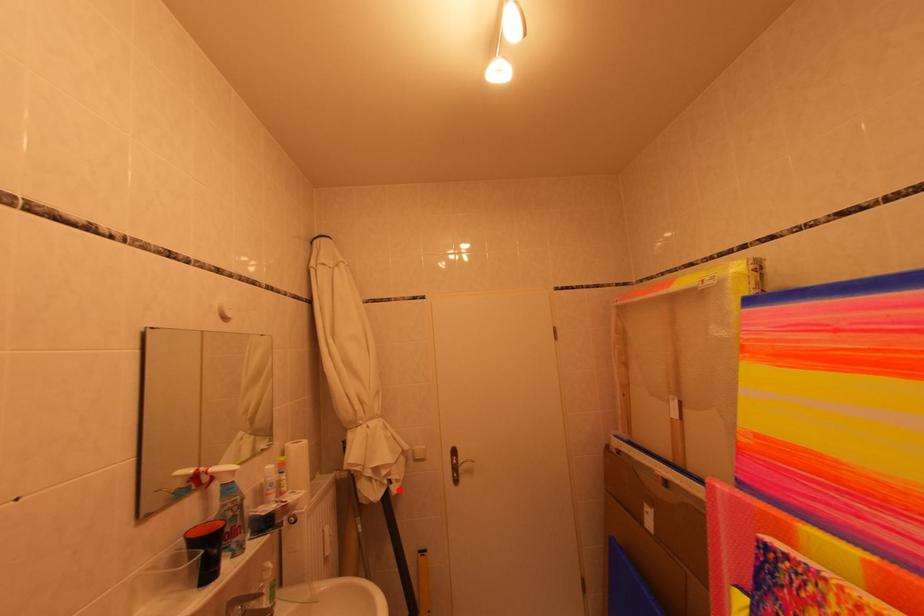
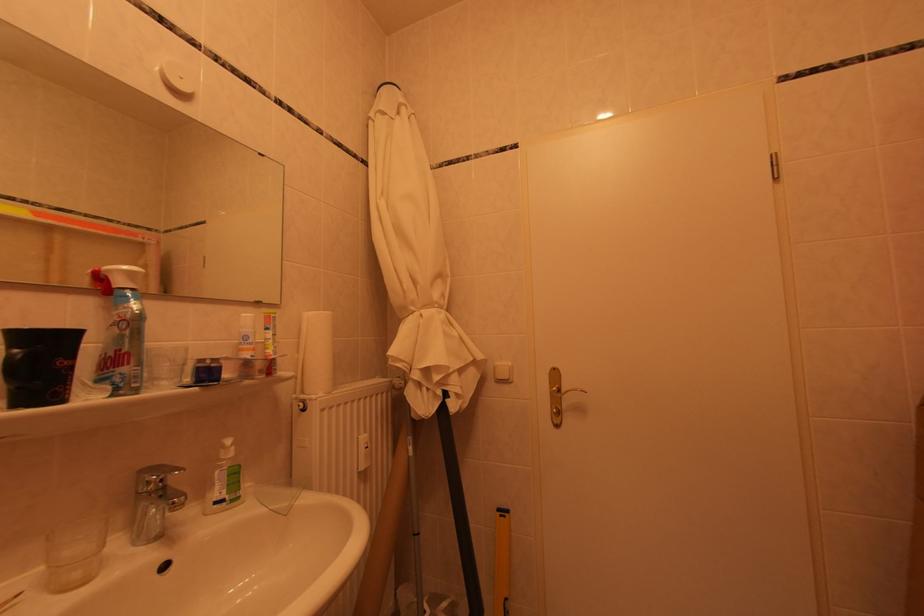
In the second image, find the point that corresponds to the highlighted location in the first image.

(456, 405)